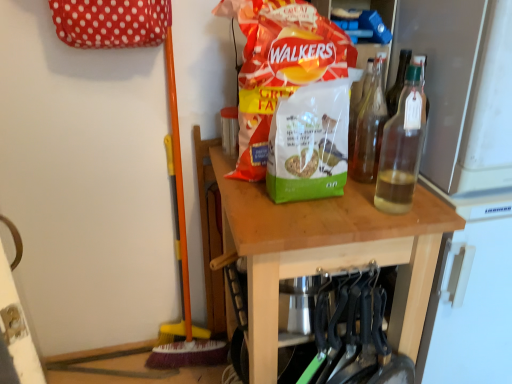
Locate an element on the screen. free location in front of translucent glass bottle at center right, which appears as the 2th bottle when viewed from the front is located at coordinates (373, 211).